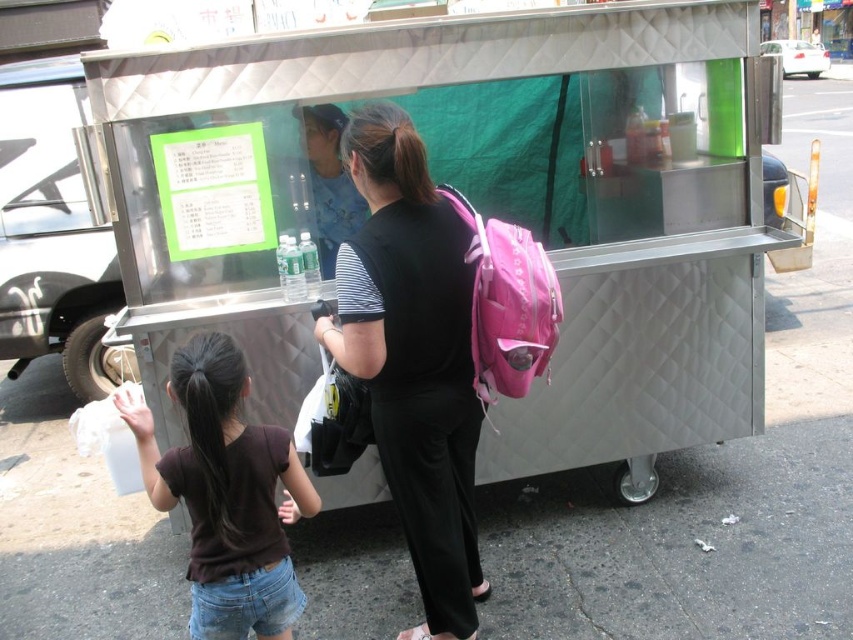
Is stainless steel cart at center further to the viewer compared to brown cotton shirt at lower left?

Yes.

Describe the element at coordinates (476, 205) in the screenshot. I see `stainless steel cart at center` at that location.

Who is more distant from viewer, (480, 136) or (230, 365)?

Positioned behind is point (480, 136).

The height and width of the screenshot is (640, 853). What are the coordinates of `stainless steel cart at center` in the screenshot? It's located at (476, 205).

Is the position of pink fabric backpack at center more distant than that of brown cotton shirt at lower left?

Yes.

Is point (426, 394) farther from camera compared to point (207, 508)?

Yes, point (426, 394) is farther from viewer.

Does point (440, 561) come farther from viewer compared to point (175, 461)?

Yes, point (440, 561) is behind point (175, 461).

This screenshot has height=640, width=853. I want to click on pink fabric backpack at center, so click(x=413, y=358).

What do you see at coordinates (476, 205) in the screenshot?
I see `stainless steel cart at center` at bounding box center [476, 205].

In the scene shown: Who is shorter, stainless steel cart at center or pink fabric backpack at center?

With less height is pink fabric backpack at center.

Between point (119, 177) and point (447, 627), which one is positioned behind?

The point (119, 177) is behind.

Identify the location of stainless steel cart at center. (476, 205).